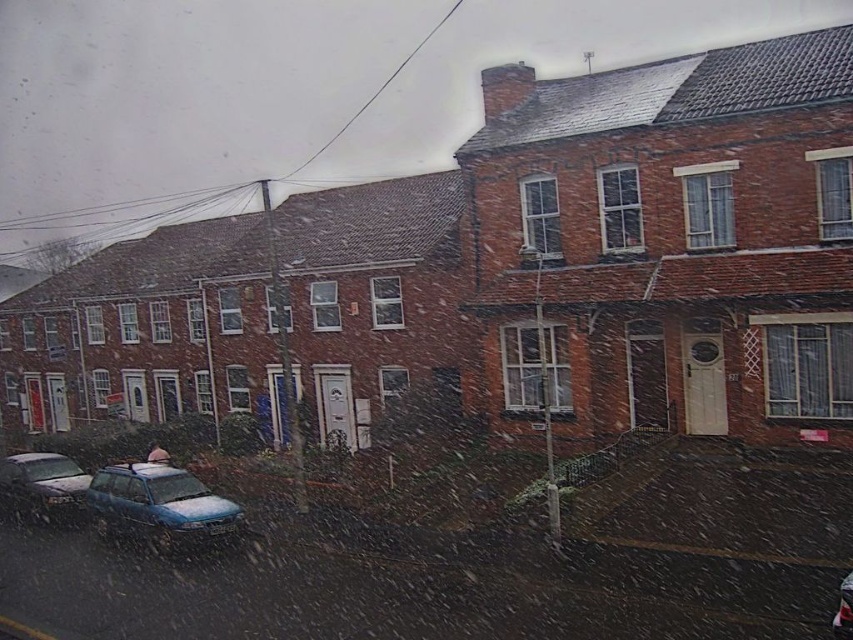
The width and height of the screenshot is (853, 640). What do you see at coordinates (160, 506) in the screenshot?
I see `blue matte car at lower left` at bounding box center [160, 506].

From the picture: Between blue matte car at lower left and metallic blue sedan at lower left, which one has more height?

With more height is blue matte car at lower left.

Is point (123, 534) less distant than point (20, 465)?

Yes, it is in front of point (20, 465).

Identify the location of blue matte car at lower left. (160, 506).

Is metallic blue sedan at lower left smaller than metallic blue car at lower left?

No, metallic blue sedan at lower left is not smaller than metallic blue car at lower left.

Who is lower down, metallic blue sedan at lower left or metallic blue car at lower left?

metallic blue sedan at lower left

What do you see at coordinates (42, 486) in the screenshot? The height and width of the screenshot is (640, 853). I see `metallic blue sedan at lower left` at bounding box center [42, 486].

Locate an element on the screen. This screenshot has width=853, height=640. metallic blue sedan at lower left is located at coordinates (42, 486).

Can you confirm if blue matte car at lower left is positioned to the left of metallic blue car at lower left?

Correct, you'll find blue matte car at lower left to the left of metallic blue car at lower left.

Who is taller, blue matte car at lower left or metallic blue car at lower left?

With more height is blue matte car at lower left.

Between point (160, 467) and point (846, 577), which one is positioned behind?

Point (160, 467)

This screenshot has height=640, width=853. What are the coordinates of `blue matte car at lower left` in the screenshot? It's located at (160, 506).